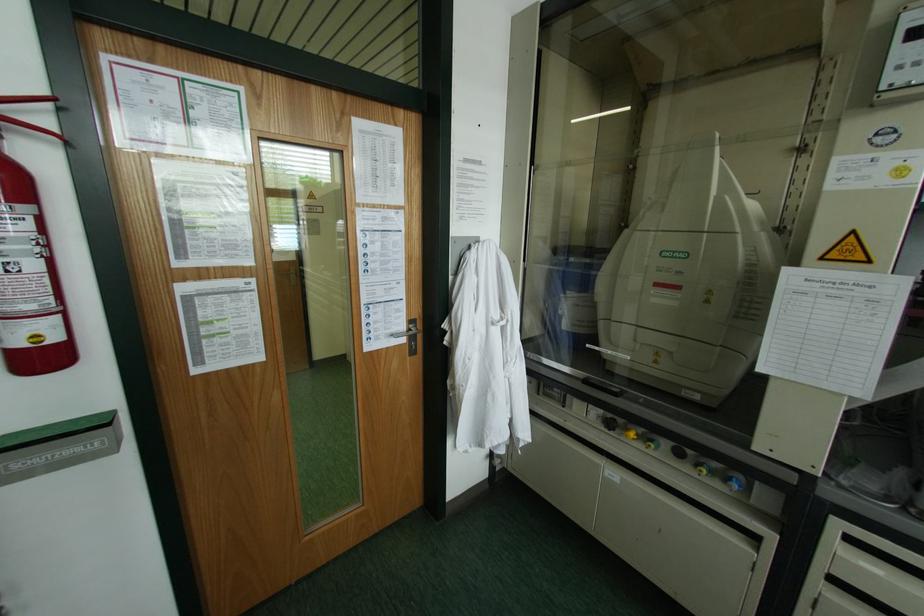
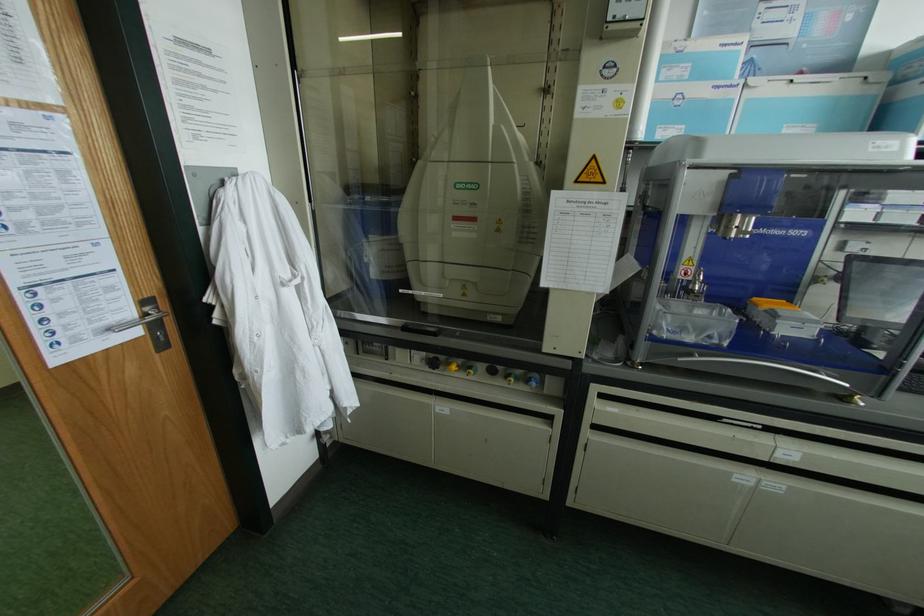
Where in the second image is the point corresponding to [631,434] from the first image?

(454, 367)